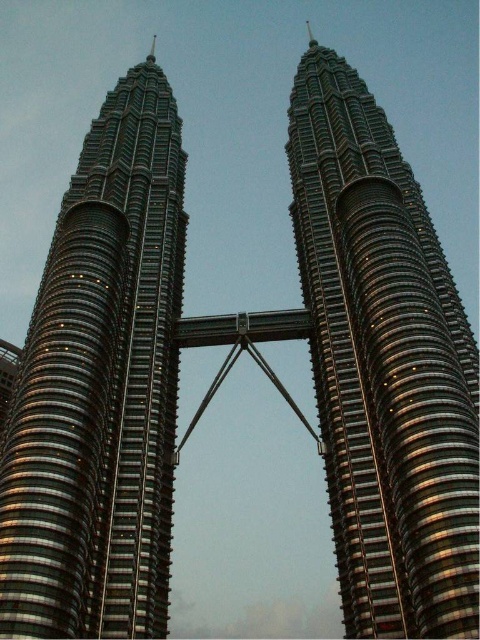
You are standing at the base of the Petronas Twin Towers and want to reach the observation deck located at point (75, 339). If your height is 1.75 meters, will you be able to comfortably walk to that point without any obstacles?

The distance between you and point (75, 339) is 78.27 meters. Since there are no mentioned obstacles in the scene description, you can comfortably walk to that point.

You are standing at the base of the Petronas Twin Towers. You notice two structures in the image, the shiny metallic skyscraper at left and the shiny metallic tower at center. Which one is positioned lower from the ground?

The shiny metallic skyscraper at left is located below the shiny metallic tower at center, so it is positioned lower from the ground.

You are standing at a viewpoint where you can see both the shiny metallic skyscraper at left and the shiny metallic tower at center. Which one is positioned more to the east if the towers are aligned north to south?

The shiny metallic skyscraper at left is positioned more to the east since it is to the left of the shiny metallic tower at center, and the towers are aligned north to south.